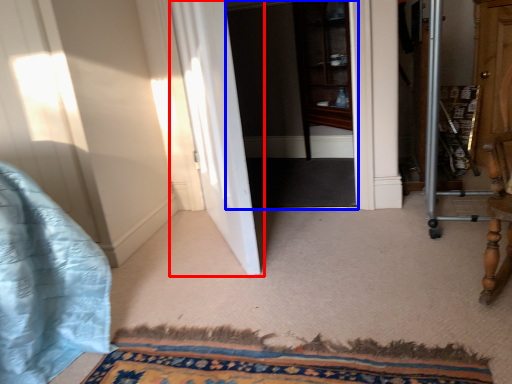
Question: Among these objects, which one is farthest to the camera, door (highlighted by a red box) or screen door (highlighted by a blue box)?

Choices:
 (A) door
 (B) screen door

Answer: (B)